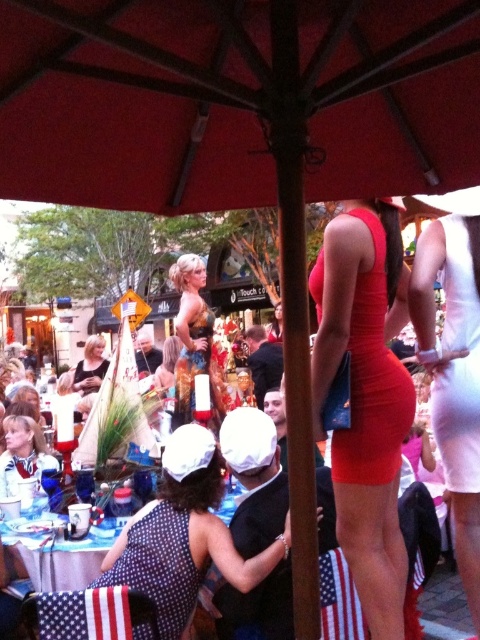
Does polka dot fabric dress at lower center appear under blonde hair at center?

Yes.

Identify the location of polka dot fabric dress at lower center. (158, 566).

Can you confirm if polka dot fabric dress at center is taller than blonde hair at center?

Yes, polka dot fabric dress at center is taller than blonde hair at center.

Who is shorter, polka dot fabric dress at center or blonde hair at center?

Standing shorter between the two is blonde hair at center.

Describe the element at coordinates (183, 536) in the screenshot. This screenshot has height=640, width=480. I see `polka dot fabric dress at center` at that location.

Identify the location of polka dot fabric dress at center. This screenshot has height=640, width=480. (183, 536).

Is polka dot fabric dress at lower center thinner than matte red dress at center?

Yes, polka dot fabric dress at lower center is thinner than matte red dress at center.

Is polka dot fabric dress at lower center taller than matte red dress at center?

In fact, polka dot fabric dress at lower center may be shorter than matte red dress at center.

What do you see at coordinates (158, 566) in the screenshot? The image size is (480, 640). I see `polka dot fabric dress at lower center` at bounding box center [158, 566].

You are a GUI agent. You are given a task and a screenshot of the screen. Output one action in this format:
    pyautogui.click(x=<x>, y=<y>)
    Task: Click on the polka dot fabric dress at lower center
    The height and width of the screenshot is (640, 480).
    Given the screenshot: What is the action you would take?
    pyautogui.click(x=158, y=566)